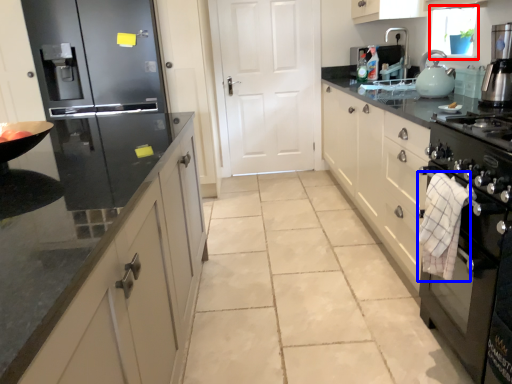
Question: Which point is closer to the camera, window screen (highlighted by a red box) or cloth (highlighted by a blue box)?

Choices:
 (A) window screen
 (B) cloth

Answer: (B)